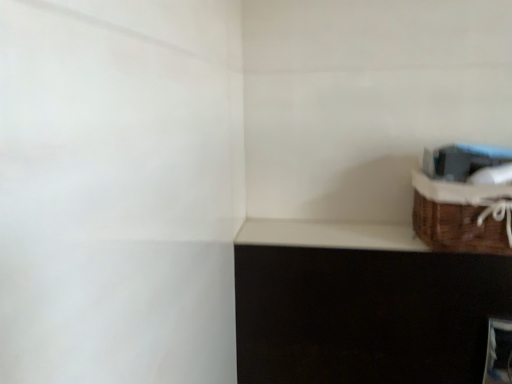
Question: In terms of width, does brown woven basket at upper right look wider or thinner when compared to white matte window sill at upper right?

Choices:
 (A) thin
 (B) wide

Answer: (B)

Question: Would you say brown woven basket at upper right is inside or outside white matte window sill at upper right?

Choices:
 (A) inside
 (B) outside

Answer: (B)

Question: Based on their positions, is brown woven basket at upper right located to the left or right of white matte window sill at upper right?

Choices:
 (A) right
 (B) left

Answer: (A)

Question: From the image's perspective, is white matte window sill at upper right located above or below brown woven basket at upper right?

Choices:
 (A) below
 (B) above

Answer: (A)

Question: Is white matte window sill at upper right wider or thinner than brown woven basket at upper right?

Choices:
 (A) thin
 (B) wide

Answer: (A)

Question: Is point (380, 233) positioned closer to the camera than point (441, 187)?

Choices:
 (A) closer
 (B) farther

Answer: (B)

Question: In the image, is white matte window sill at upper right on the left side or the right side of brown woven basket at upper right?

Choices:
 (A) right
 (B) left

Answer: (B)